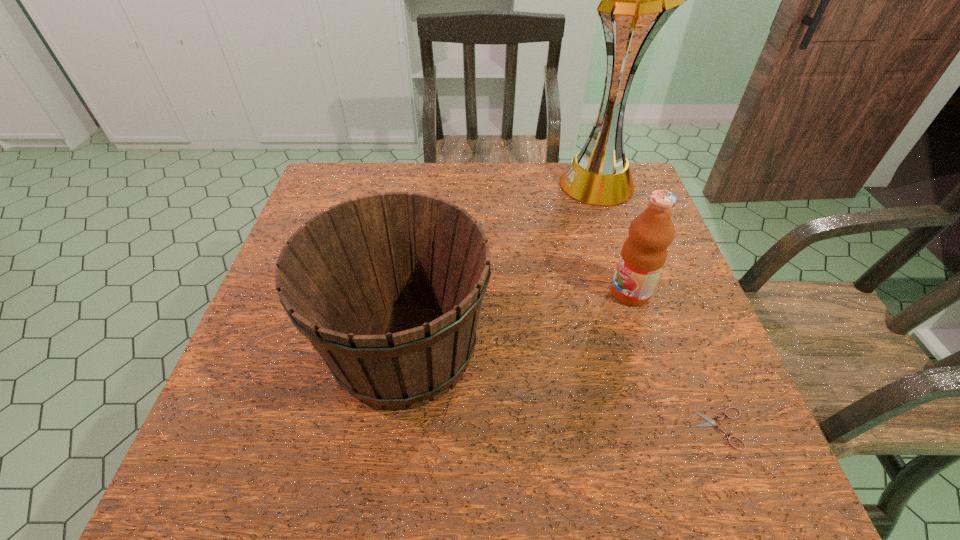
Identify the location of the farthest object. (636, 0).

Identify the location of the tallest object. The image size is (960, 540). (636, 0).

Where is `fruit juice`? Image resolution: width=960 pixels, height=540 pixels. fruit juice is located at coordinates (644, 252).

The height and width of the screenshot is (540, 960). Identify the location of wine bucket. (388, 288).

Where is `the shortest object`? the shortest object is located at coordinates tap(710, 422).

Identify the location of vacant space located on the front-facing side of the farthest object. Image resolution: width=960 pixels, height=540 pixels. (487, 184).

Find the location of a particular element. This screenshot has height=540, width=960. blank space located on the front-facing side of the farthest object is located at coordinates (530, 184).

Where is `blank space located on the front-facing side of the farthest object`? The image size is (960, 540). blank space located on the front-facing side of the farthest object is located at coordinates (530, 184).

Locate an element on the screen. free region located 0.320m on the front label of the fruit juice is located at coordinates (472, 293).

The width and height of the screenshot is (960, 540). I want to click on blank space located 0.350m on the front label of the fruit juice, so click(459, 293).